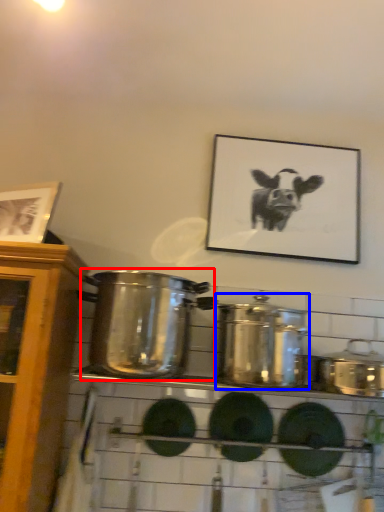
Question: Which of the following is the closest to the observer, crock pot (highlighted by a red box) or crock pot (highlighted by a blue box)?

Choices:
 (A) crock pot
 (B) crock pot

Answer: (B)